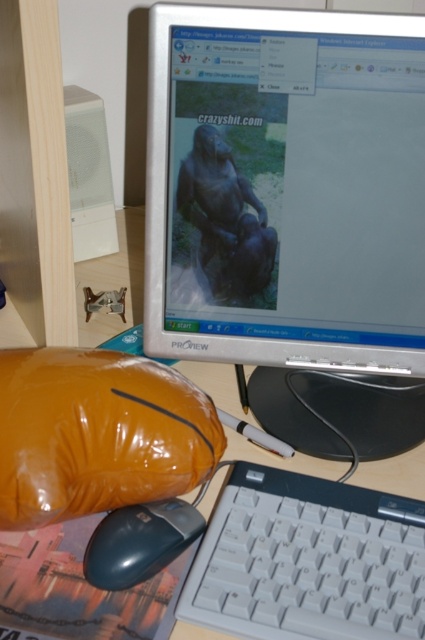
From the picture: You are organizing your workspace and need to move the orange fabric pillow at lower left and the white plastic computer desk at lower center. Based on their positions, which object is closer to the floor?

The orange fabric pillow at lower left is closer to the floor since it is located below the white plastic computer desk at lower center.

You are organizing a small party in the room where the white plastic computer desk at lower center is located. You want to place the orange fabric pillow at lower left on the desk. Will the pillow fit on the desk without overlapping the edges?

The orange fabric pillow at lower left is narrower than the white plastic computer desk at lower center, so it should fit without overlapping the edges.